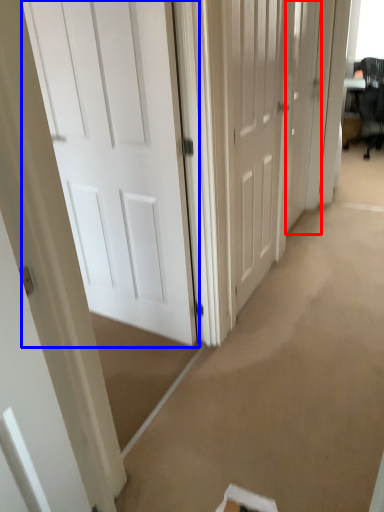
Question: Among these objects, which one is nearest to the camera, door (highlighted by a red box) or door (highlighted by a blue box)?

Choices:
 (A) door
 (B) door

Answer: (B)